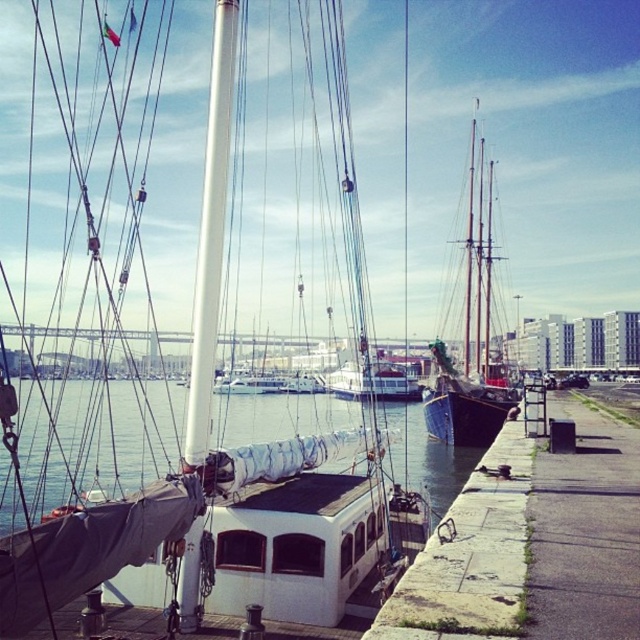
Question: Can you confirm if dark blue wooden sailboat at center is positioned above white glossy sailboat at center?

Choices:
 (A) yes
 (B) no

Answer: (A)

Question: Based on their relative distances, which object is nearer to the white matte water at center?

Choices:
 (A) dark blue wooden sailboat at center
 (B) white glossy sailboat at center

Answer: (A)

Question: In this image, where is white matte water at center located relative to white glossy sailboat at center?

Choices:
 (A) above
 (B) below

Answer: (A)

Question: Which object is farther from the camera taking this photo?

Choices:
 (A) white glossy sailboat at center
 (B) white matte water at center
 (C) dark blue wooden sailboat at center

Answer: (A)

Question: Which of the following is the closest to the observer?

Choices:
 (A) (408, 388)
 (B) (140, 602)

Answer: (B)

Question: From the image, what is the correct spatial relationship of white matte water at center in relation to dark blue wooden sailboat at center?

Choices:
 (A) right
 (B) left

Answer: (B)